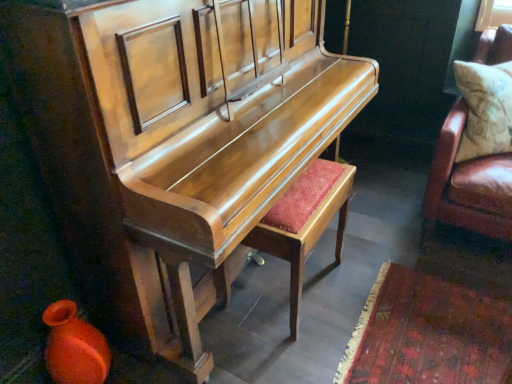
Locate an element on the screen. Image resolution: width=512 pixels, height=384 pixels. vacant area that is situated to the right of matte wood stool at center is located at coordinates (384, 288).